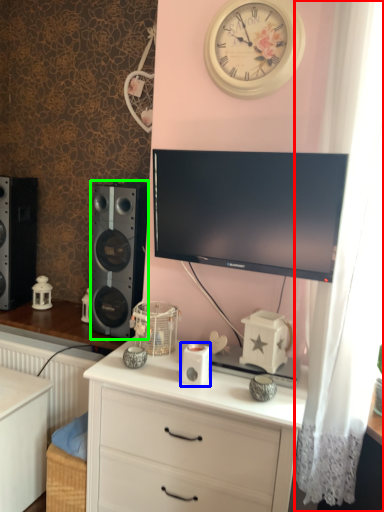
Question: Estimate the real-world distances between objects in this image. Which object is closer to curtain (highlighted by a red box), ipod (highlighted by a blue box) or speaker (highlighted by a green box)?

Choices:
 (A) ipod
 (B) speaker

Answer: (A)